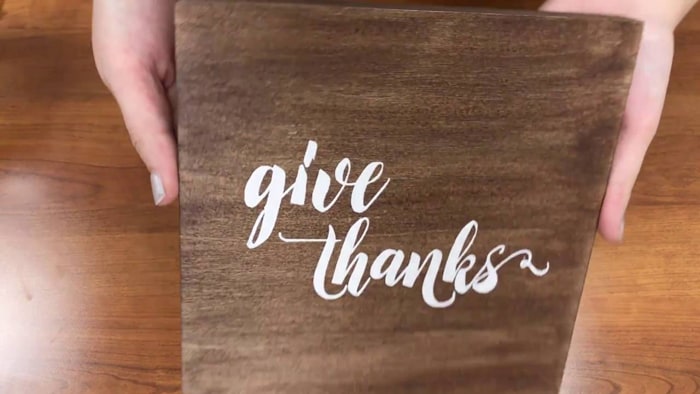
Locate an element on the screen. Image resolution: width=700 pixels, height=394 pixels. wooden tabletop is located at coordinates (99, 251).